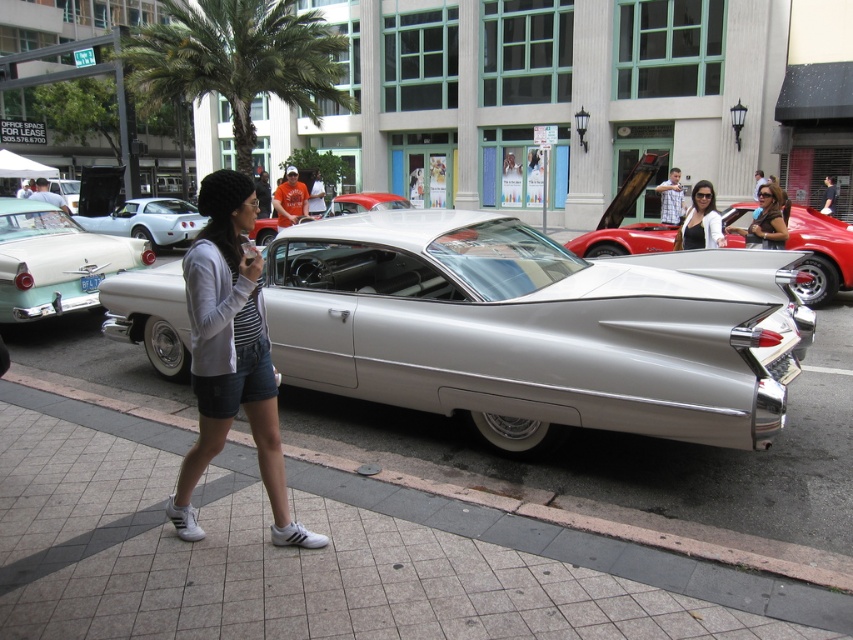
You are a photographer wanting to capture both the silver metallic car at center and the green leafy palm tree at upper center in the same frame. Given their heights, which object will appear taller in the photo?

The green leafy palm tree at upper center will appear taller in the photo since it is taller than the silver metallic car at center according to the description.

You are standing on the sidewalk in front of the vintage cars and want to walk towards the building. Which point, point (318, 93) or point (129, 225), is closer to you as you start walking?

Point (318, 93) is closer to you because it is further to the viewer than point (129, 225).

You are a photographer trying to capture the silver metallic car at center and the green leafy palm tree at upper center in a single shot. Based on their sizes in the image, which object would appear smaller in the final photograph?

The silver metallic car at center would appear smaller in the final photograph because it has a smaller size compared to the green leafy palm tree at upper center.